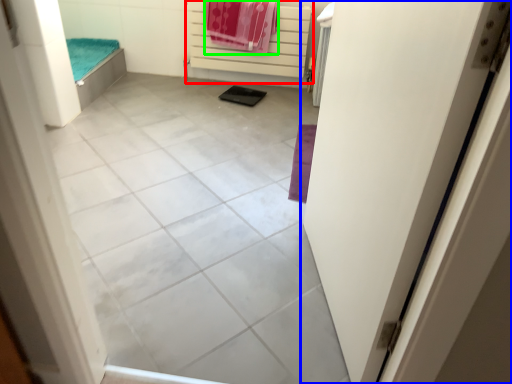
Question: Estimate the real-world distances between objects in this image. Which object is closer to balustrade (highlighted by a red box), door (highlighted by a blue box) or beach towel (highlighted by a green box)?

Choices:
 (A) door
 (B) beach towel

Answer: (B)